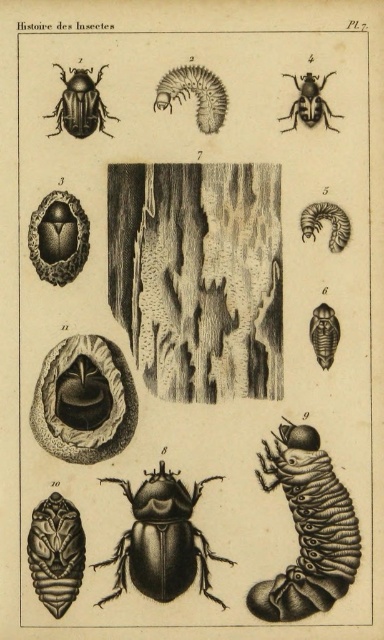
Based on the provided scene description, what object is located at the coordinates point (309, 102)?

→ The object at point (309, 102) is the matte black beetle at upper center.